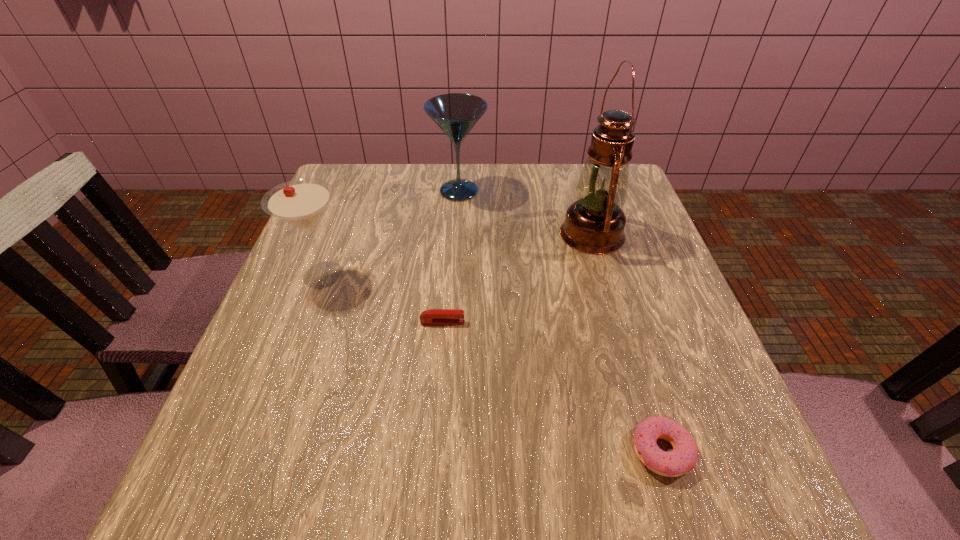
Find the location of a particular element. the tallest object is located at coordinates (594, 224).

The height and width of the screenshot is (540, 960). I want to click on the farthest object, so click(x=456, y=114).

This screenshot has height=540, width=960. Identify the location of the farther martini. (456, 114).

The height and width of the screenshot is (540, 960). In order to click on the nearer martini in this screenshot , I will do `click(300, 203)`.

I want to click on the leftmost object, so click(300, 203).

Find the location of a particular element. This screenshot has width=960, height=540. the nearest object is located at coordinates (683, 457).

I want to click on stapler, so click(x=433, y=316).

Image resolution: width=960 pixels, height=540 pixels. I want to click on blank area located on the back of the tallest object, so click(576, 179).

Where is `vacant space located on the left of the farthest object`? vacant space located on the left of the farthest object is located at coordinates [361, 191].

The height and width of the screenshot is (540, 960). I want to click on vacant space located on the back of the left martini, so click(362, 170).